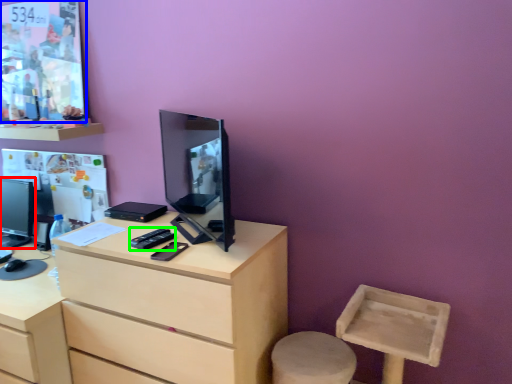
Question: Considering the real-world distances, which object is closest to television (highlighted by a red box)? poster page (highlighted by a blue box) or remote control (highlighted by a green box).

Choices:
 (A) poster page
 (B) remote control

Answer: (A)